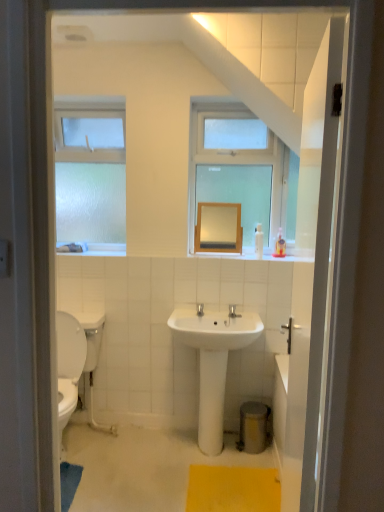
Question: Is yellow textured bath mat at lower center surrounding frosted glass window at left?

Choices:
 (A) no
 (B) yes

Answer: (A)

Question: Does yellow textured bath mat at lower center have a lesser width compared to frosted glass window at left?

Choices:
 (A) no
 (B) yes

Answer: (A)

Question: Is yellow textured bath mat at lower center to the left of frosted glass window at left from the viewer's perspective?

Choices:
 (A) no
 (B) yes

Answer: (A)

Question: From the image's perspective, does yellow textured bath mat at lower center appear lower than frosted glass window at left?

Choices:
 (A) no
 (B) yes

Answer: (B)

Question: From the image's perspective, is yellow textured bath mat at lower center above frosted glass window at left?

Choices:
 (A) no
 (B) yes

Answer: (A)

Question: Considering the positions of frosted glass window at left and white glossy sink at center in the image, is frosted glass window at left taller or shorter than white glossy sink at center?

Choices:
 (A) short
 (B) tall

Answer: (B)

Question: Is frosted glass window at left bigger or smaller than white glossy sink at center?

Choices:
 (A) big
 (B) small

Answer: (B)

Question: Is frosted glass window at left inside the boundaries of white glossy sink at center, or outside?

Choices:
 (A) inside
 (B) outside

Answer: (B)

Question: Is point (76, 188) positioned closer to the camera than point (248, 320)?

Choices:
 (A) farther
 (B) closer

Answer: (A)

Question: Considering the positions of smooth wooden mirror at center and yellow textured bath mat at lower center in the image, is smooth wooden mirror at center taller or shorter than yellow textured bath mat at lower center?

Choices:
 (A) tall
 (B) short

Answer: (A)

Question: From a real-world perspective, relative to yellow textured bath mat at lower center, is smooth wooden mirror at center vertically above or below?

Choices:
 (A) above
 (B) below

Answer: (A)

Question: In the image, is smooth wooden mirror at center positioned in front of or behind yellow textured bath mat at lower center?

Choices:
 (A) front
 (B) behind

Answer: (B)

Question: From the image's perspective, relative to yellow textured bath mat at lower center, is smooth wooden mirror at center above or below?

Choices:
 (A) above
 (B) below

Answer: (A)

Question: From a real-world perspective, is smooth wooden mirror at center above or below frosted glass window at left?

Choices:
 (A) above
 (B) below

Answer: (B)

Question: In terms of width, does smooth wooden mirror at center look wider or thinner when compared to frosted glass window at left?

Choices:
 (A) thin
 (B) wide

Answer: (A)